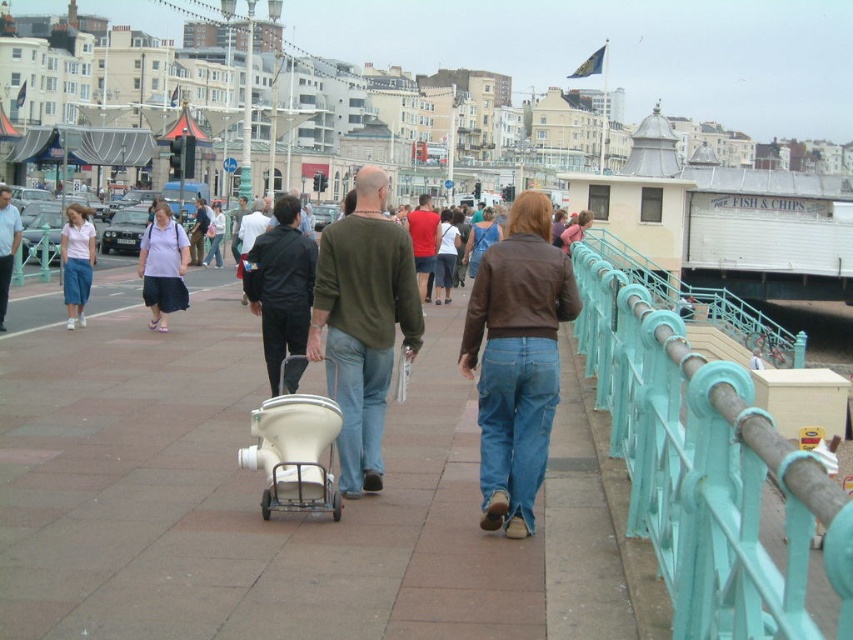
At what (x,y) coordinates should I click in order to perform the action: click on matte green sweater at center. Please return your answer as a coordinate pair (x, y). The height and width of the screenshot is (640, 853). Looking at the image, I should click on (363, 324).

Does point (338, 248) come farther from viewer compared to point (308, 440)?

Yes, it is.

Locate an element on the screen. The width and height of the screenshot is (853, 640). matte green sweater at center is located at coordinates (363, 324).

Does matte green sweater at center have a greater height compared to matte purple blouse at center?

Yes.

Looking at this image, measure the distance from matte green sweater at center to matte purple blouse at center.

They are 10.19 meters apart.

The image size is (853, 640). I want to click on matte green sweater at center, so click(x=363, y=324).

Image resolution: width=853 pixels, height=640 pixels. Find the location of `matte green sweater at center`. matte green sweater at center is located at coordinates (363, 324).

Does teal painted metal railing at right have a greater height compared to dark brown leather jacket at center?

Yes, teal painted metal railing at right is taller than dark brown leather jacket at center.

Does point (669, 369) lie in front of point (207, 212)?

That is True.

You are a GUI agent. You are given a task and a screenshot of the screen. Output one action in this format:
    pyautogui.click(x=<x>, y=<y>)
    Task: Click on the teal painted metal railing at right
    The height and width of the screenshot is (640, 853).
    Given the screenshot: What is the action you would take?
    tap(708, 472)